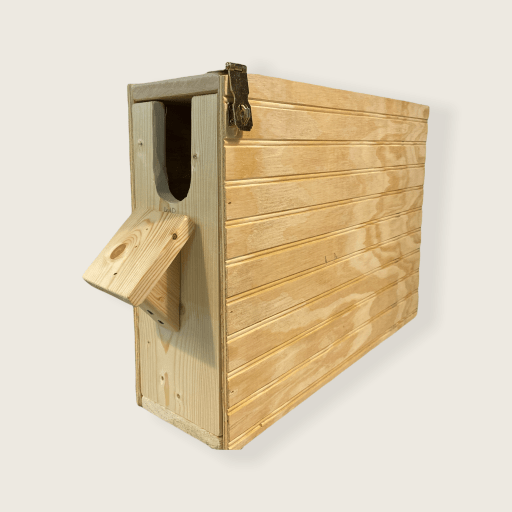
You are a GUI agent. You are given a task and a screenshot of the screen. Output one action in this format:
    pyautogui.click(x=<x>, y=<y>)
    Task: Click on the beadboard
    This screenshot has height=512, width=512.
    Given the screenshot: What is the action you would take?
    click(x=323, y=256)